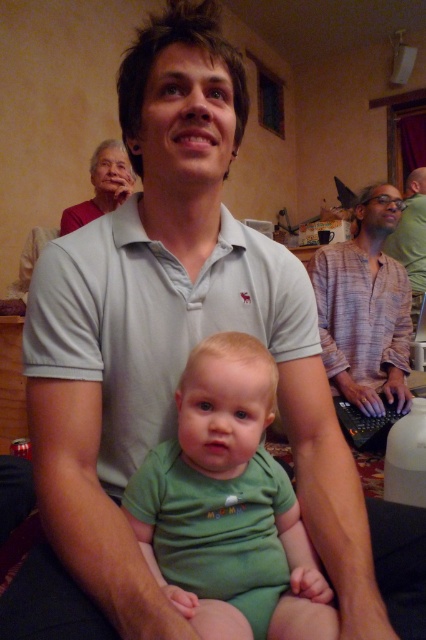
Can you confirm if striped cotton shirt at right is shorter than plaid shirt at center?

Yes, striped cotton shirt at right is shorter than plaid shirt at center.

Locate an element on the screen. striped cotton shirt at right is located at coordinates (365, 307).

Is light gray cotton polo shirt at center positioned in front of striped cotton shirt at right?

Yes.

This screenshot has height=640, width=426. What are the coordinates of `light gray cotton polo shirt at center` in the screenshot? It's located at (155, 321).

What do you see at coordinates (155, 321) in the screenshot? Image resolution: width=426 pixels, height=640 pixels. I see `light gray cotton polo shirt at center` at bounding box center [155, 321].

Where is `light gray cotton polo shirt at center`? Image resolution: width=426 pixels, height=640 pixels. light gray cotton polo shirt at center is located at coordinates (155, 321).

Measure the distance from light gray cotton polo shirt at center to plaid shirt at center.

light gray cotton polo shirt at center is 2.28 meters away from plaid shirt at center.

Is point (267, 346) closer to viewer compared to point (419, 193)?

Yes.

Describe the element at coordinates (155, 321) in the screenshot. I see `light gray cotton polo shirt at center` at that location.

You are a GUI agent. You are given a task and a screenshot of the screen. Output one action in this format:
    pyautogui.click(x=<x>, y=<y>)
    Task: Click on the light gray cotton polo shirt at center
    This screenshot has height=640, width=426.
    Given the screenshot: What is the action you would take?
    (155, 321)